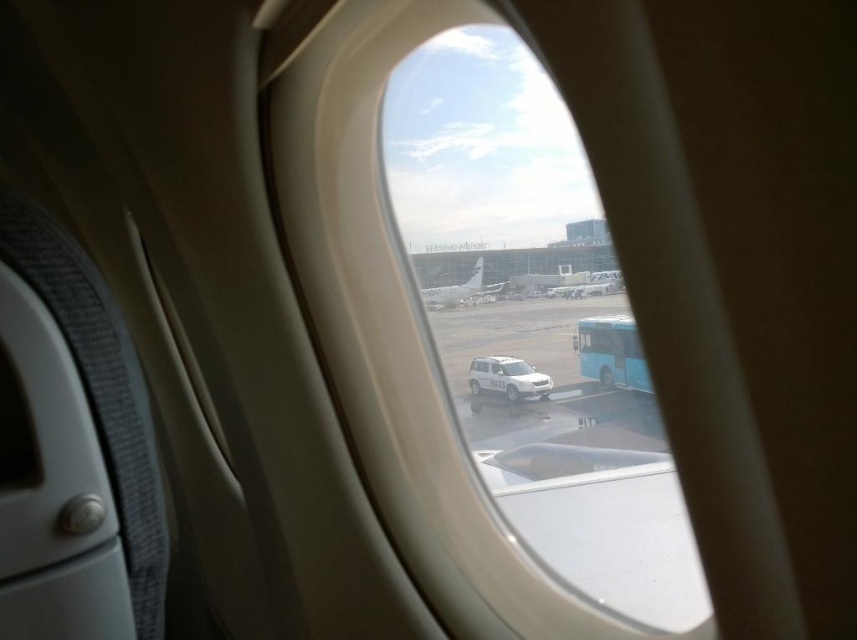
Between point (482, 292) and point (597, 278), which one is positioned in front?

Positioned in front is point (597, 278).

In the scene shown: Is white matte airplane at center taller than metallic silver airplane at center?

No, white matte airplane at center is not taller than metallic silver airplane at center.

Image resolution: width=857 pixels, height=640 pixels. I want to click on white matte airplane at center, so click(460, 289).

The image size is (857, 640). What are the coordinates of `white matte airplane at center` in the screenshot? It's located at (460, 289).